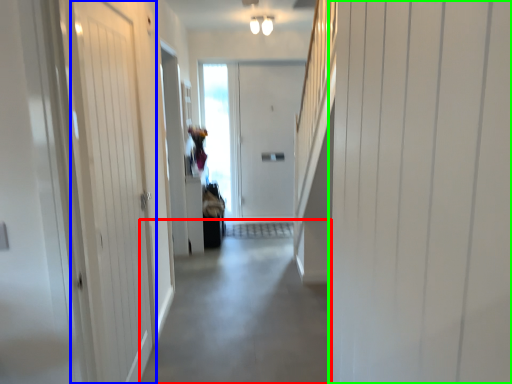
Question: Which object is the farthest from alley (highlighted by a red box)? Choose among these: door (highlighted by a blue box) or door (highlighted by a green box).

Choices:
 (A) door
 (B) door

Answer: (B)